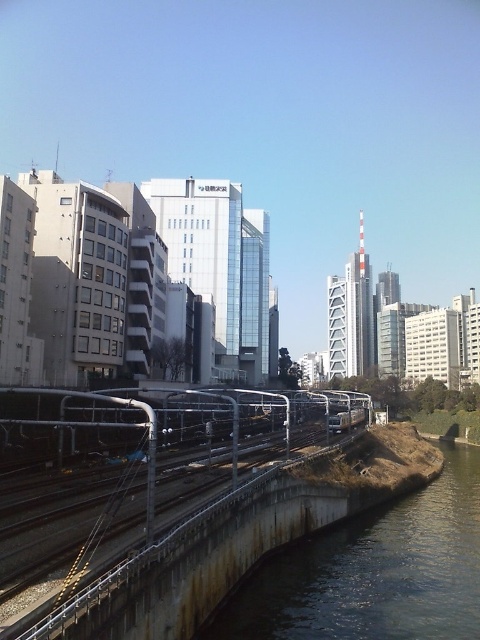
You are a pedestrian standing on the embankment next to the brown concrete river at lower right. You want to board the silver metallic passenger train at center that is moving towards the right. Is there a direct path from your current position to the train without crossing any tracks?

The brown concrete river at lower right is below the silver metallic passenger train at center, so there is no direct path from the river to the train without crossing the tracks.